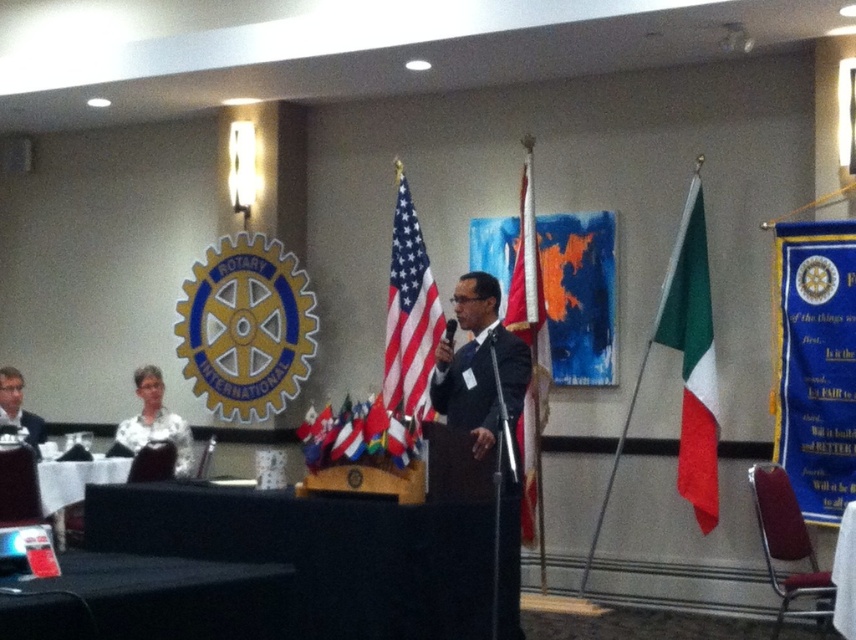
Question: Which point appears closest to the camera in this image?

Choices:
 (A) (140, 397)
 (B) (274, 637)
 (C) (515, 534)
 (D) (354, 456)

Answer: (B)

Question: Is black suit at center positioned in front of american flag at center?

Choices:
 (A) no
 (B) yes

Answer: (B)

Question: Is polished wood podium at center closer to the viewer compared to matte plastic flag at center?

Choices:
 (A) yes
 (B) no

Answer: (B)

Question: Estimate the real-world distances between objects in this image. Which object is closer to the black suit at center?

Choices:
 (A) american flag at center
 (B) matte plastic flag at center
 (C) black fabric table at lower left

Answer: (B)

Question: Considering the real-world distances, which object is closest to the american flag at center?

Choices:
 (A) polished wood podium at center
 (B) white cloth table at lower left

Answer: (A)

Question: Can you confirm if black fabric table at lower left is smaller than white shirt at left?

Choices:
 (A) no
 (B) yes

Answer: (B)